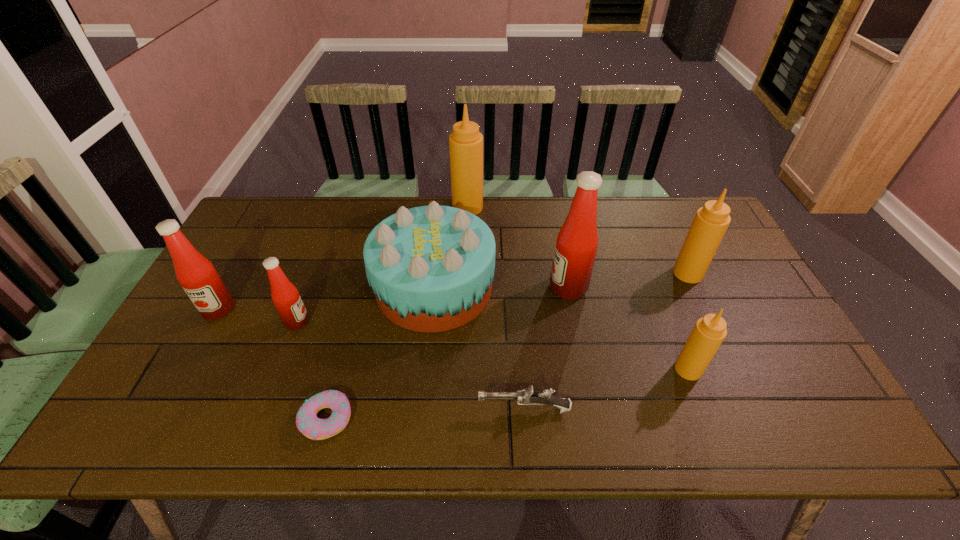
Find the location of a particular element. the seventh farthest object is located at coordinates (709, 331).

Find the location of a particular element. The image size is (960, 540). the smallest red condiment is located at coordinates (285, 296).

Find the location of a particular element. The height and width of the screenshot is (540, 960). the second object from left to right is located at coordinates (285, 296).

This screenshot has width=960, height=540. In order to click on gun in this screenshot , I will do `click(528, 396)`.

Find the location of a particular element. The height and width of the screenshot is (540, 960). the shortest object is located at coordinates (307, 422).

The image size is (960, 540). Identify the location of vacant area located on the right of the leftmost tan condiment. (528, 207).

In order to click on free space located 0.050m on the front-facing side of the biggest red condiment in this screenshot , I will do `click(533, 288)`.

This screenshot has height=540, width=960. I want to click on vacant space located on the front-facing side of the biggest red condiment, so click(440, 288).

The width and height of the screenshot is (960, 540). I want to click on vacant space located 0.150m on the front-facing side of the biggest red condiment, so click(x=498, y=288).

Where is `vacant area located on the left of the rightmost tan condiment`? The width and height of the screenshot is (960, 540). vacant area located on the left of the rightmost tan condiment is located at coordinates (640, 273).